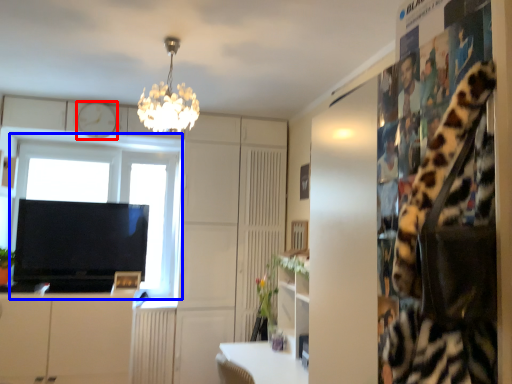
Question: Which object appears closest to the camera in this image, clock (highlighted by a red box) or window (highlighted by a blue box)?

Choices:
 (A) clock
 (B) window

Answer: (A)